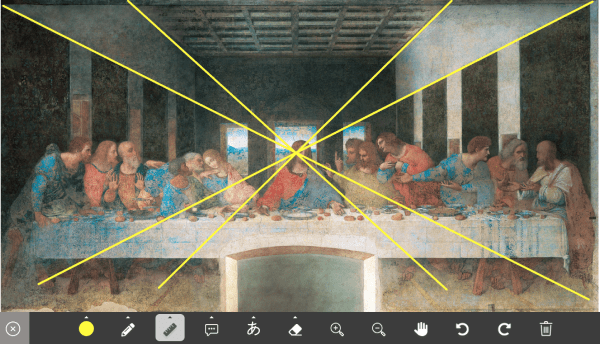
Identify the location of ceiling. click(x=284, y=38), click(x=321, y=25), click(x=270, y=24).